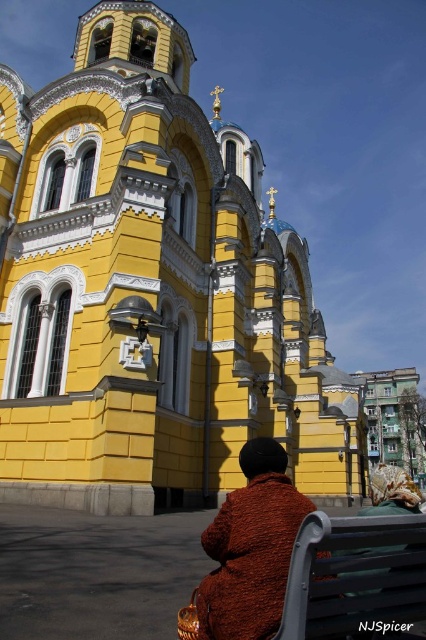
Question: Which point is farther to the camera?

Choices:
 (A) metallic gray bench at lower right
 (B) yellow stone church at center
 (C) brown fuzzy coat at lower right
 (D) knitted brown coat at center

Answer: (B)

Question: Estimate the real-world distances between objects in this image. Which object is closer to the brown fuzzy coat at lower right?

Choices:
 (A) yellow stone church at center
 (B) knitted brown coat at center

Answer: (B)

Question: Which point is farther to the camera?

Choices:
 (A) yellow stone church at center
 (B) metallic gray bench at lower right
 (C) brown fuzzy coat at lower right
 (D) knitted brown coat at center

Answer: (A)

Question: Does yellow stone church at center appear on the right side of metallic gray bench at lower right?

Choices:
 (A) yes
 (B) no

Answer: (B)

Question: Does metallic gray bench at lower right appear on the left side of brown fuzzy coat at lower right?

Choices:
 (A) no
 (B) yes

Answer: (B)

Question: Where is yellow stone church at center located in relation to brown fuzzy coat at lower right in the image?

Choices:
 (A) right
 (B) left

Answer: (B)